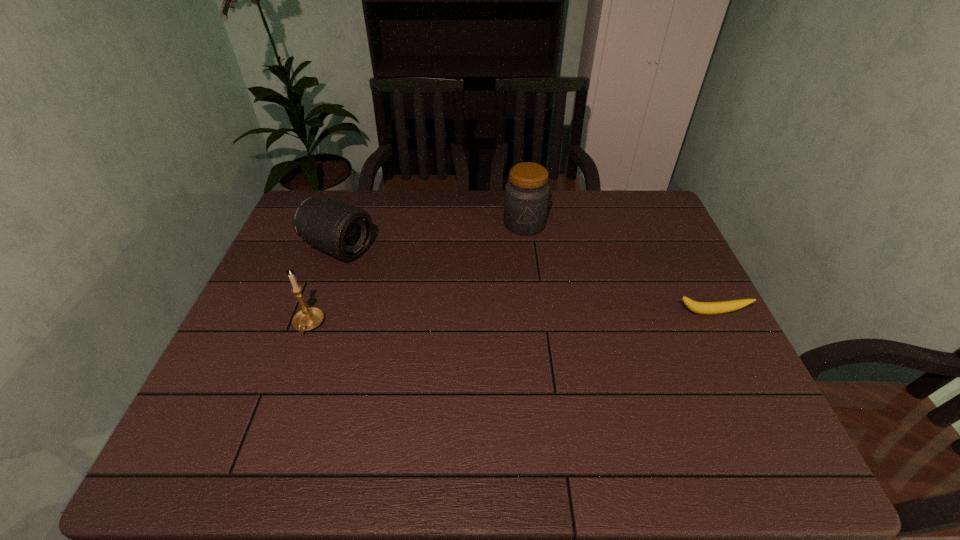
The image size is (960, 540). Identify the location of free region located 0.330m on the surface of the third tallest object. (462, 300).

In order to click on free region located on the surface of the third tallest object in this screenshot , I will do `click(392, 269)`.

Image resolution: width=960 pixels, height=540 pixels. I want to click on vacant space located on the surface of the third tallest object, so click(458, 299).

At what (x,y) coordinates should I click in order to perform the action: click on jar that is at the far edge. Please return your answer as a coordinate pair (x, y). The height and width of the screenshot is (540, 960). Looking at the image, I should click on (526, 198).

Where is `telephoto lens that is positioned at the far edge`? The image size is (960, 540). telephoto lens that is positioned at the far edge is located at coordinates [344, 231].

Identify the location of candle holder situated at the left edge. (309, 318).

Locate an element on the screen. Image resolution: width=960 pixels, height=540 pixels. telephoto lens present at the left edge is located at coordinates (344, 231).

Locate an element on the screen. object that is at the right edge is located at coordinates (704, 308).

Locate an element on the screen. object present at the far left corner is located at coordinates (344, 231).

What are the coordinates of `vacant space at the far edge` in the screenshot? It's located at (434, 212).